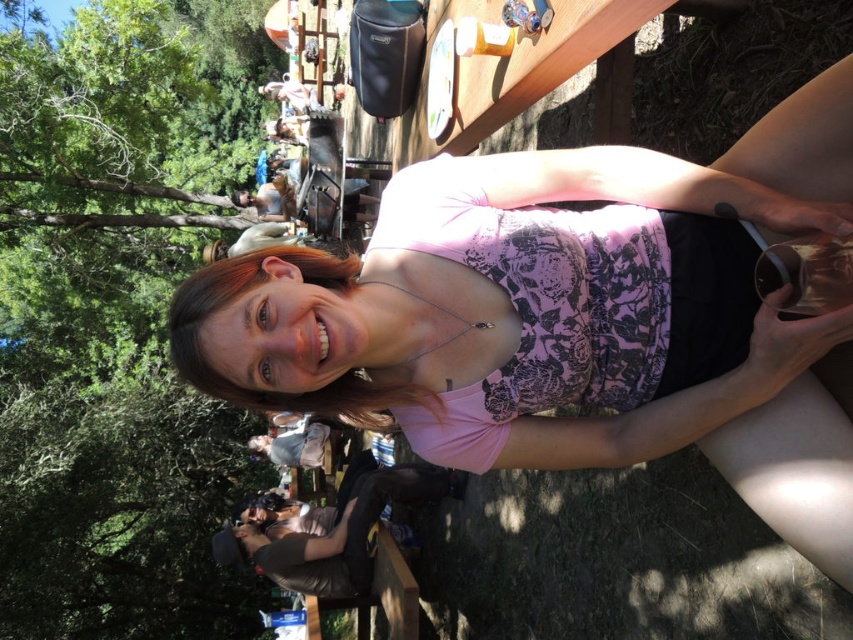
Is pink floral tank top at center to the left of pink fabric blouse at center from the viewer's perspective?

No, pink floral tank top at center is not to the left of pink fabric blouse at center.

Can you confirm if pink floral tank top at center is positioned above pink fabric blouse at center?

Correct, pink floral tank top at center is located above pink fabric blouse at center.

Locate an element on the screen. pink floral tank top at center is located at coordinates pyautogui.click(x=569, y=317).

Between black leather jacket at lower center and pink fabric blouse at center, which one has less height?

With less height is pink fabric blouse at center.

Does black leather jacket at lower center have a greater height compared to pink fabric blouse at center?

Yes.

Find the location of a particular element. black leather jacket at lower center is located at coordinates (334, 529).

At what (x,y) coordinates should I click in order to perform the action: click on black leather jacket at lower center. Please return your answer as a coordinate pair (x, y). The image size is (853, 640). Looking at the image, I should click on (334, 529).

Does pink floral tank top at center appear over black leather jacket at lower center?

Correct, pink floral tank top at center is located above black leather jacket at lower center.

The image size is (853, 640). In order to click on pink floral tank top at center in this screenshot , I will do `click(569, 317)`.